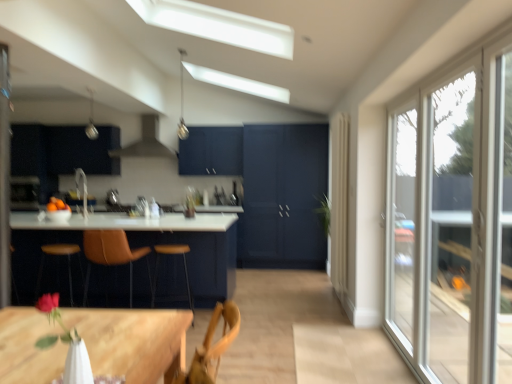
Where is `free space below orange matte bowl at left (from a real-world perspective)`? This screenshot has height=384, width=512. free space below orange matte bowl at left (from a real-world perspective) is located at coordinates (58, 206).